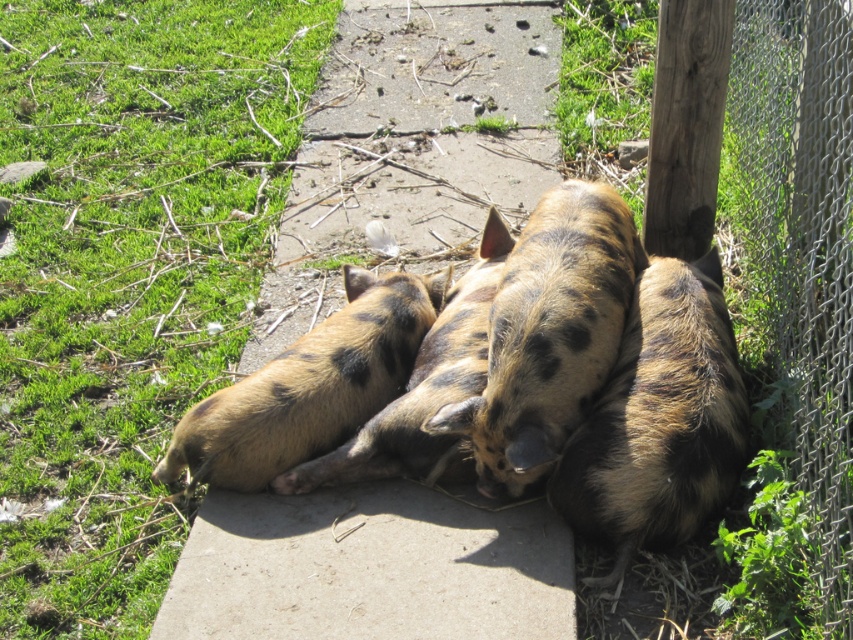
Does speckled fur pig at center have a smaller size compared to speckled fur piglet at center?

Indeed, speckled fur pig at center has a smaller size compared to speckled fur piglet at center.

Who is more distant from viewer, (653, 349) or (178, 461)?

Point (178, 461)

Find the location of a particular element. The width and height of the screenshot is (853, 640). speckled fur pig at center is located at coordinates (659, 419).

Based on the photo, which of these two, green grass at lower left or speckled fur piglet at center, stands taller?

green grass at lower left

Can you confirm if green grass at lower left is smaller than speckled fur piglet at center?

Actually, green grass at lower left might be larger than speckled fur piglet at center.

Locate an element on the screen. green grass at lower left is located at coordinates tap(126, 273).

Can you confirm if speckled fur pig at center is shorter than spotted fur pig at center?

Correct, speckled fur pig at center is not as tall as spotted fur pig at center.

Who is taller, speckled fur pig at center or spotted fur pig at center?

With more height is spotted fur pig at center.

Describe the element at coordinates (659, 419) in the screenshot. I see `speckled fur pig at center` at that location.

In order to click on speckled fur pig at center in this screenshot , I will do `click(659, 419)`.